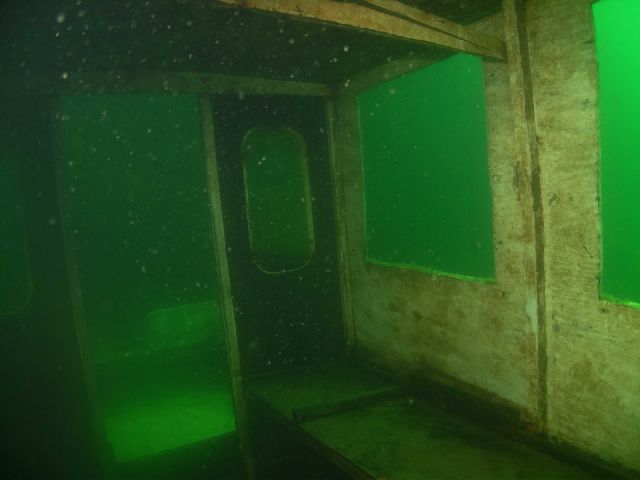
In order to click on door frame in this screenshot , I will do `click(228, 307)`, `click(336, 173)`, `click(150, 80)`, `click(74, 284)`.